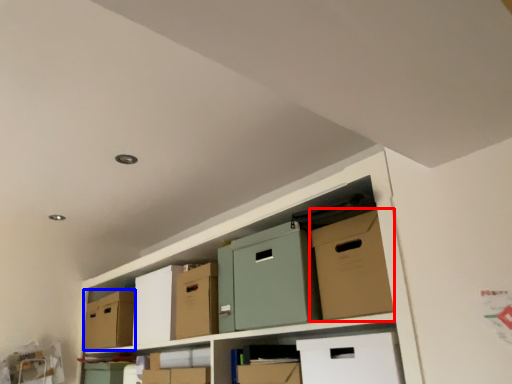
Question: Which object is further to the camera taking this photo, cardboard box (highlighted by a red box) or cardboard box (highlighted by a blue box)?

Choices:
 (A) cardboard box
 (B) cardboard box

Answer: (B)